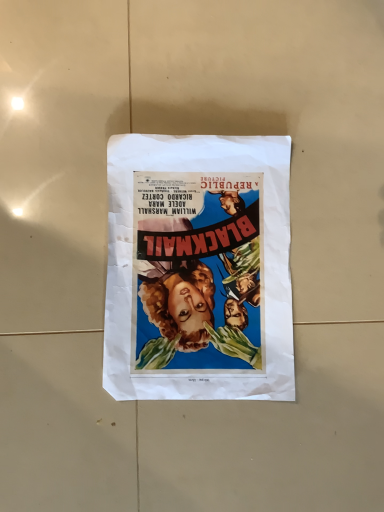
The width and height of the screenshot is (384, 512). I want to click on free spot above matte paper poster at center (from a real-world perspective), so click(x=201, y=256).